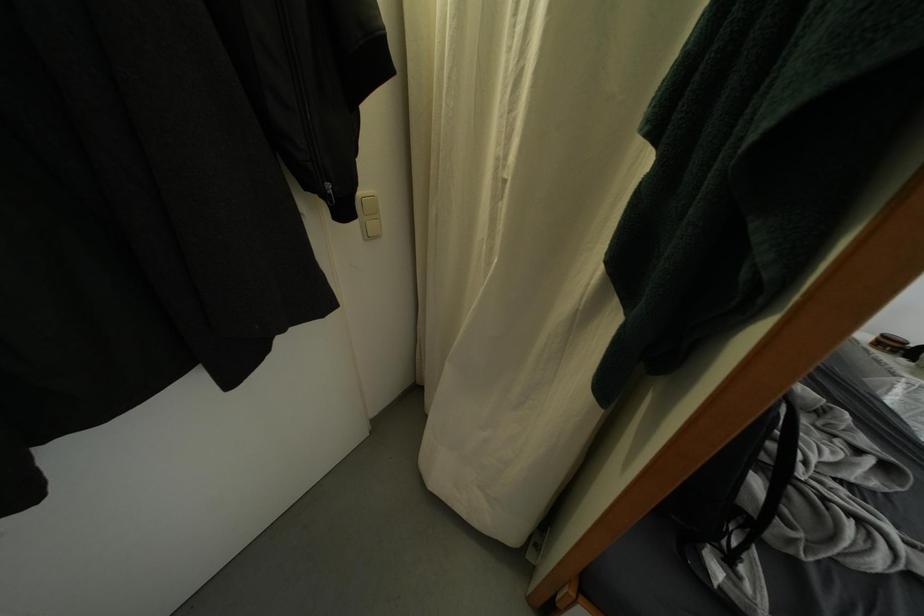
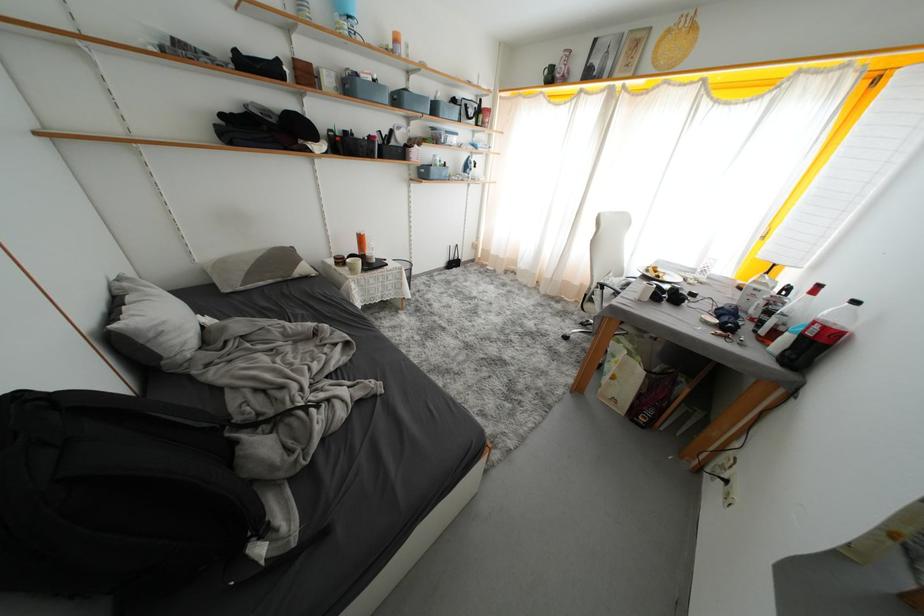
How did the camera likely rotate?

The rotation direction of the camera is right-down.